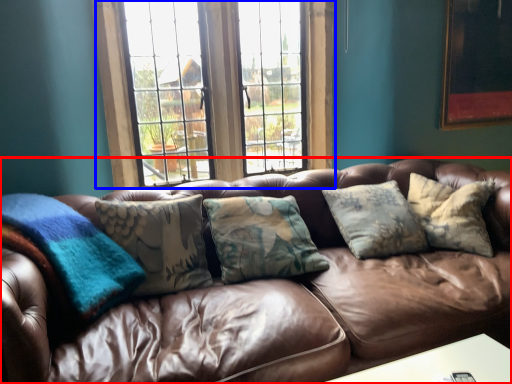
Question: Which object is closer to the camera taking this photo, studio couch (highlighted by a red box) or window (highlighted by a blue box)?

Choices:
 (A) studio couch
 (B) window

Answer: (A)